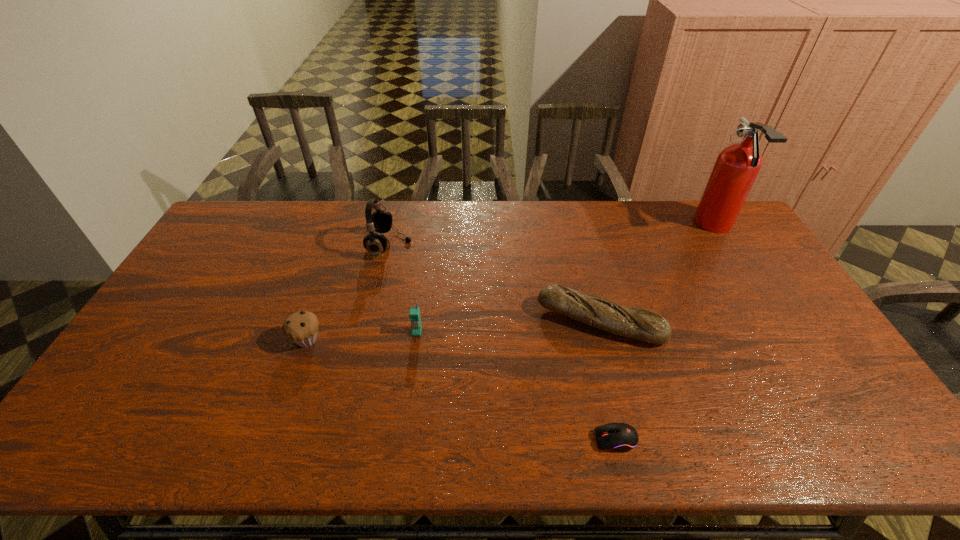
You are a GUI agent. You are given a task and a screenshot of the screen. Output one action in this format:
    pyautogui.click(x=<x>, y=<y>)
    Task: Click on the rightmost object
    The image size is (960, 540).
    Given the screenshot: What is the action you would take?
    click(x=737, y=166)

In order to click on the tallest object in this screenshot , I will do `click(737, 166)`.

The width and height of the screenshot is (960, 540). I want to click on the fifth shortest object, so [x=379, y=221].

Locate an element on the screen. The image size is (960, 540). headset is located at coordinates (379, 221).

Locate an element on the screen. The image size is (960, 540). cellular telephone is located at coordinates (414, 314).

You are a GUI agent. You are given a task and a screenshot of the screen. Output one action in this format:
    pyautogui.click(x=<x>, y=<y>)
    Task: Click on the fourth object from right to left
    
    Given the screenshot: What is the action you would take?
    pyautogui.click(x=414, y=314)

You are a GUI agent. You are given a task and a screenshot of the screen. Output one action in this format:
    pyautogui.click(x=<x>, y=<y>)
    Task: Click on the leftmost object
    
    Given the screenshot: What is the action you would take?
    pyautogui.click(x=301, y=327)

Identify the location of baguet. (641, 324).

Where is `computer mouse`? This screenshot has width=960, height=540. computer mouse is located at coordinates (622, 437).

You are a GUI agent. You are given a task and a screenshot of the screen. Output one action in this format:
    pyautogui.click(x=<x>, y=<y>)
    Task: Click on the nearest object
    This screenshot has height=540, width=960.
    Given the screenshot: What is the action you would take?
    pyautogui.click(x=622, y=437)